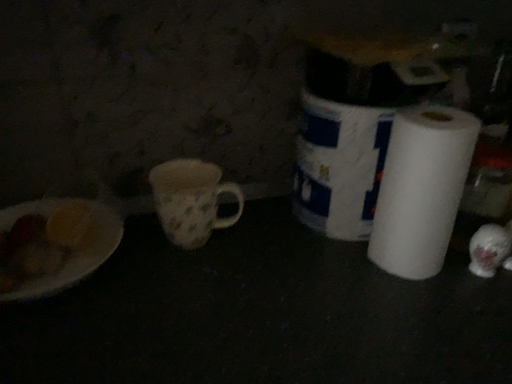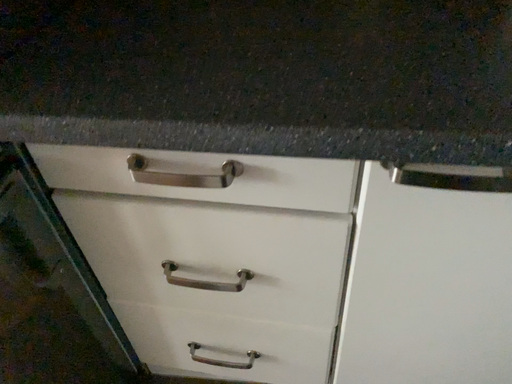
Question: Which way did the camera rotate in the video?

Choices:
 (A) rotated right
 (B) rotated left

Answer: (B)